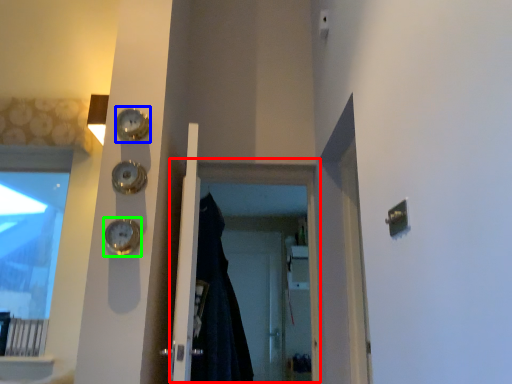
Question: Considering the real-world distances, which object is farthest from screen door (highlighted by a red box)? clock (highlighted by a blue box) or clock (highlighted by a green box)?

Choices:
 (A) clock
 (B) clock

Answer: (B)